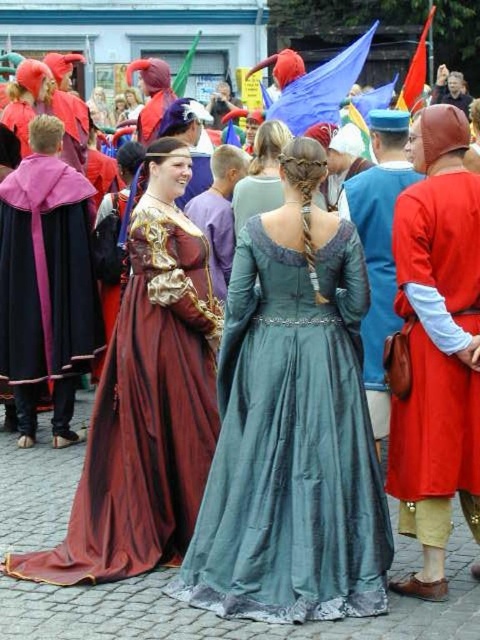
Is silky teal gown at center taller than velvet maroon cape at left?

Yes.

Can you confirm if silky teal gown at center is shorter than velvet maroon cape at left?

No.

Identify the location of silky teal gown at center. This screenshot has width=480, height=640. (291, 426).

You are a GUI agent. You are given a task and a screenshot of the screen. Output one action in this format:
    pyautogui.click(x=<x>, y=<y>)
    Task: Click on the silky teal gown at center
    The width and height of the screenshot is (480, 640).
    Given the screenshot: What is the action you would take?
    pyautogui.click(x=291, y=426)

Between point (275, 280) and point (151, 282), which one is positioned in front?

Point (275, 280) is in front.

Where is `silky teal gown at center`? Image resolution: width=480 pixels, height=640 pixels. silky teal gown at center is located at coordinates [x=291, y=426].

Who is more forward, (279,378) or (441,460)?

Positioned in front is point (441,460).

Is point (296, 456) closer to viewer compared to point (444, 460)?

No, (296, 456) is behind (444, 460).

Locate an element on the screen. silky teal gown at center is located at coordinates pyautogui.click(x=291, y=426).